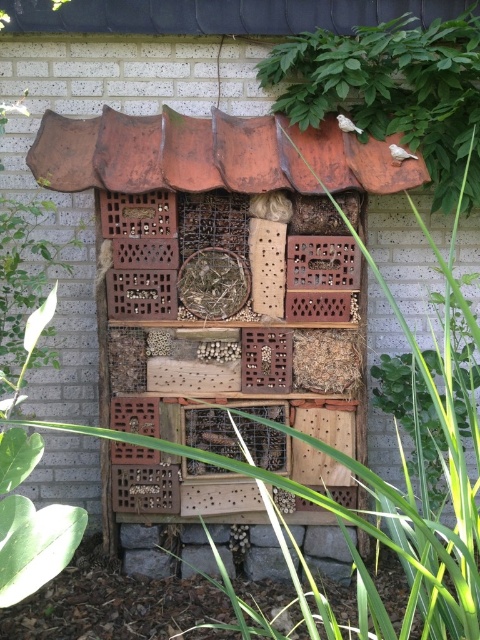
Question: Can you confirm if green leafy plant at upper right is positioned to the right of wooden birdhouse at center?

Choices:
 (A) yes
 (B) no

Answer: (A)

Question: Is green leafy plant at upper right closer to camera compared to wooden birdhouse at center?

Choices:
 (A) yes
 (B) no

Answer: (B)

Question: Among these points, which one is farthest from the camera?

Choices:
 (A) (444, 346)
 (B) (435, 150)

Answer: (B)

Question: Which object is farther from the camera taking this photo?

Choices:
 (A) wooden birdhouse at center
 (B) green leafy plant at upper right

Answer: (B)

Question: Considering the relative positions of green leafy plant at upper right and wooden birdhouse at center in the image provided, where is green leafy plant at upper right located with respect to wooden birdhouse at center?

Choices:
 (A) left
 (B) right

Answer: (B)